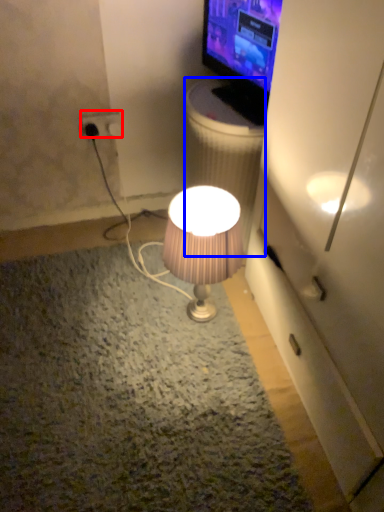
Question: Which object is further to the camera taking this photo, power outlet (highlighted by a red box) or trash bin/can (highlighted by a blue box)?

Choices:
 (A) power outlet
 (B) trash bin/can

Answer: (A)